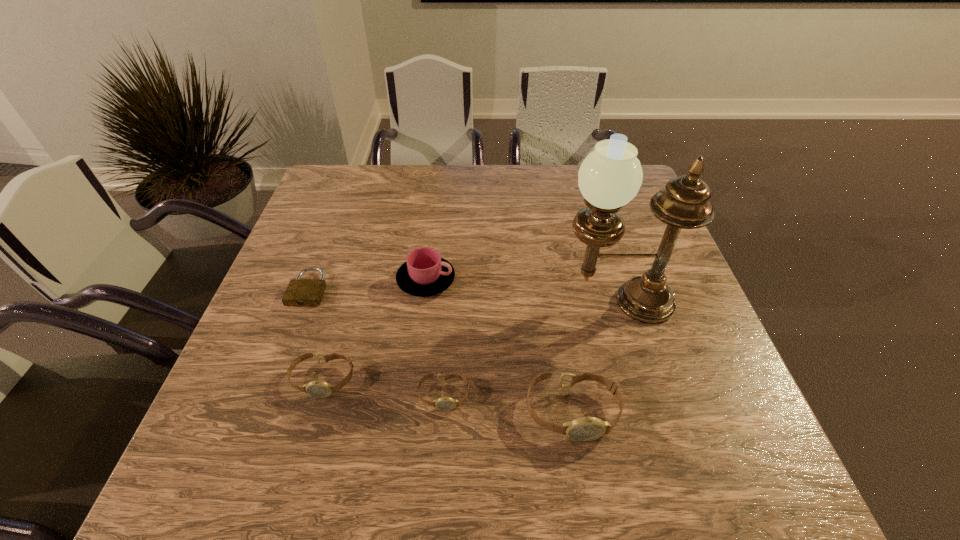
Locate an element on the screen. Image resolution: width=960 pixels, height=540 pixels. free spot between the second watch from left to right and the tallest object is located at coordinates [529, 349].

The width and height of the screenshot is (960, 540). Identify the location of unoccupied position between the leftmost watch and the cup. point(374,330).

The image size is (960, 540). Find the location of `free space between the oil lamp and the shortest watch`. free space between the oil lamp and the shortest watch is located at coordinates (529, 349).

This screenshot has width=960, height=540. Find the location of `unoccupied position between the third shortest object and the tallest watch`. unoccupied position between the third shortest object and the tallest watch is located at coordinates (447, 396).

Find the location of a particular element. The image size is (960, 540). vacant area that lies between the tallest watch and the second tallest watch is located at coordinates (447, 396).

Where is `vacant point located between the second shortest watch and the cup`? vacant point located between the second shortest watch and the cup is located at coordinates (374, 330).

The image size is (960, 540). Find the location of `vacant region between the second shortest object and the tallest watch`. vacant region between the second shortest object and the tallest watch is located at coordinates (508, 403).

This screenshot has height=540, width=960. In order to click on vacant area that lies between the second watch from left to right and the tallest watch in this screenshot , I will do pos(508,403).

The width and height of the screenshot is (960, 540). In order to click on vacant space that is in between the fourth tallest object and the cup in this screenshot , I will do `click(374, 330)`.

Locate which object is the third closest to the oil lamp. Please provide its 2D coordinates. Your answer should be formatted as a tuple, i.e. [(x, y)], where the tuple contains the x and y coordinates of a point satisfying the conditions above.

[(445, 403)]